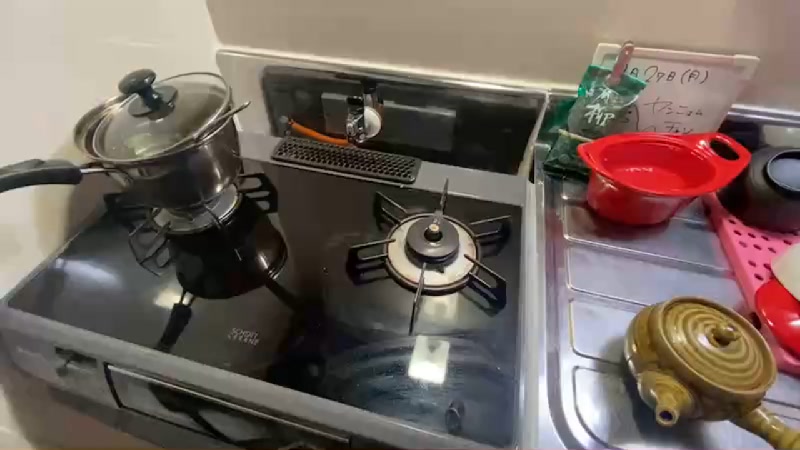
This screenshot has height=450, width=800. I want to click on white wall, so click(x=66, y=51).